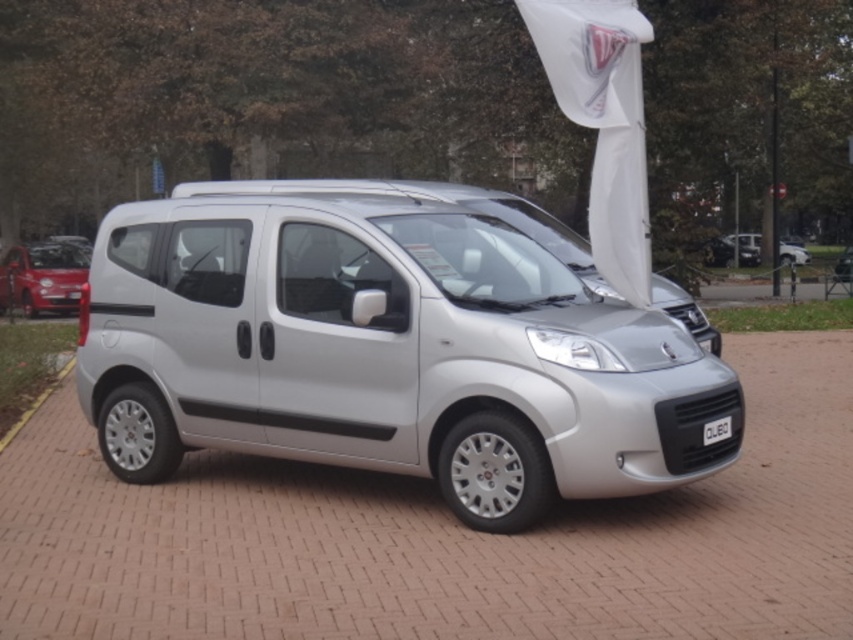
You are a parking attendant and need to fit both the satin silver minivan at center and the matte red car at left into a parking spot that can only accommodate one vehicle. Which vehicle should you choose to park in the spot?

The satin silver minivan at center is smaller than the matte red car at left, so it can fit better in the parking spot designed for one vehicle.